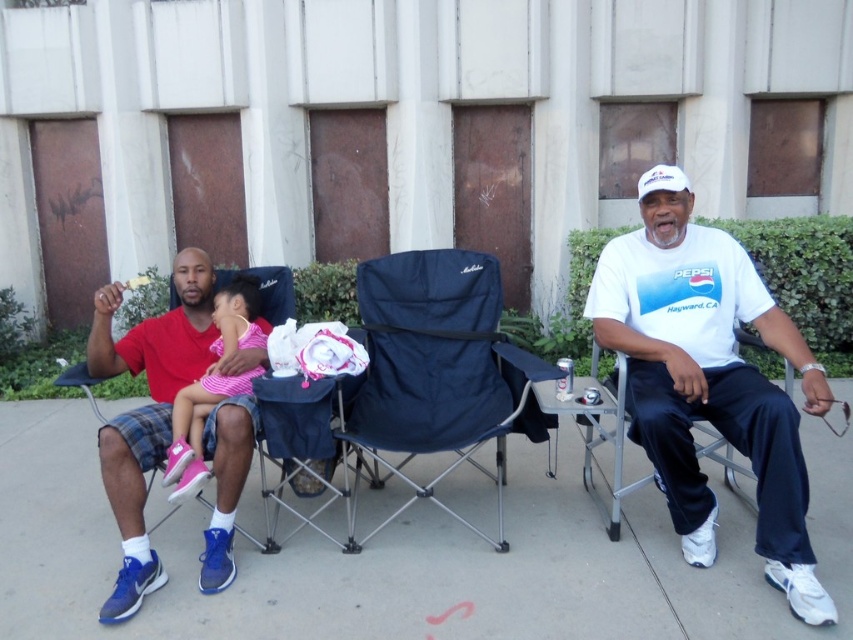
Question: Which object is positioned farthest from the matte red shirt at left?

Choices:
 (A) pink fabric baby at left
 (B) navy blue fabric folding chair at center
 (C) white cotton t-shirt at center

Answer: (C)

Question: Which of the following is the farthest from the observer?

Choices:
 (A) matte red shirt at left
 (B) white cotton t-shirt at center

Answer: (A)

Question: Observing the image, what is the correct spatial positioning of white cotton t-shirt at center in reference to matte red shirt at left?

Choices:
 (A) left
 (B) right

Answer: (B)

Question: Can you confirm if navy blue fabric folding chair at center is positioned below matte red shirt at left?

Choices:
 (A) yes
 (B) no

Answer: (B)

Question: Which is nearer to the matte red shirt at left?

Choices:
 (A) pink fabric baby at left
 (B) white cotton t-shirt at center
 (C) navy blue fabric folding chair at center

Answer: (A)

Question: Can you confirm if white cotton t-shirt at center is positioned to the right of matte red shirt at left?

Choices:
 (A) yes
 (B) no

Answer: (A)